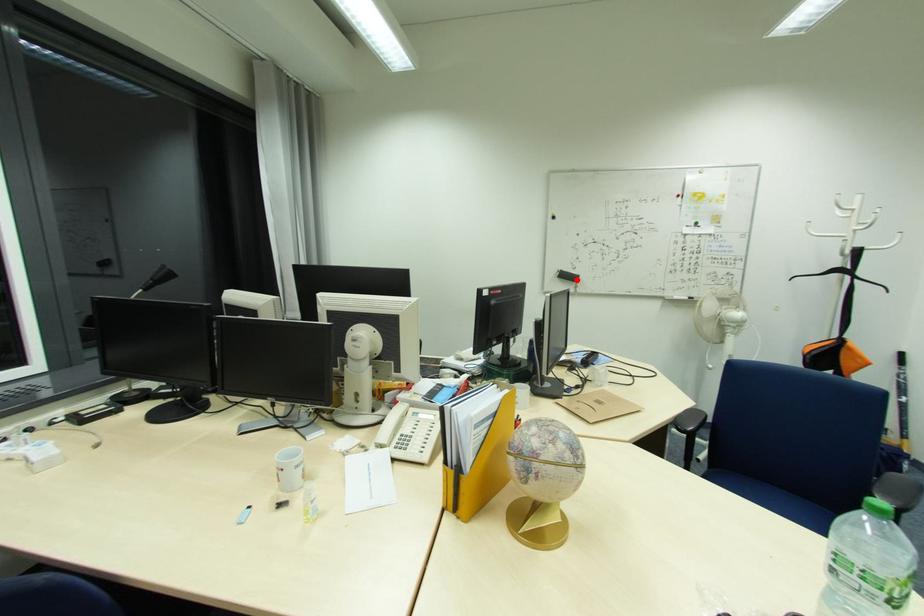
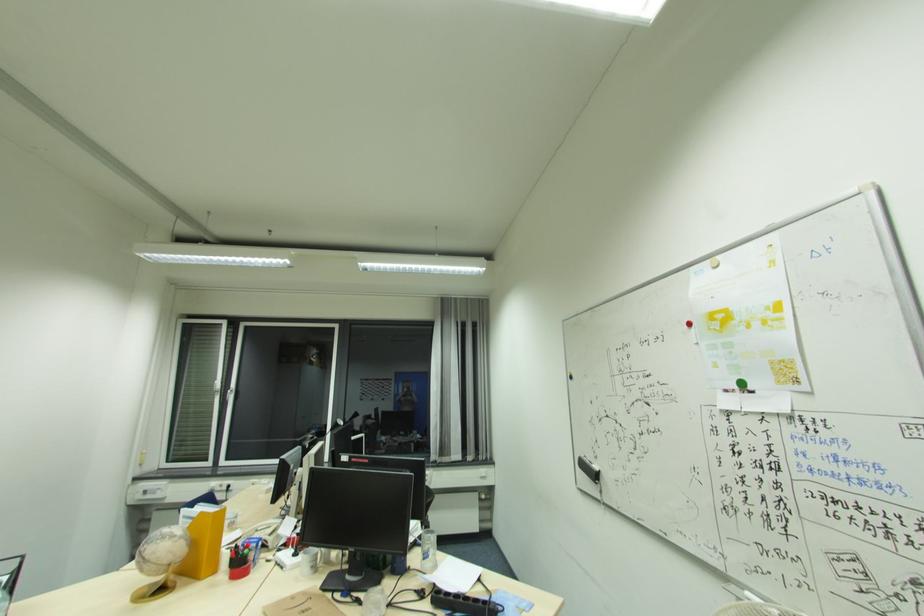
In the second image, find the point that corresponds to the highlighted location in the first image.

(598, 476)